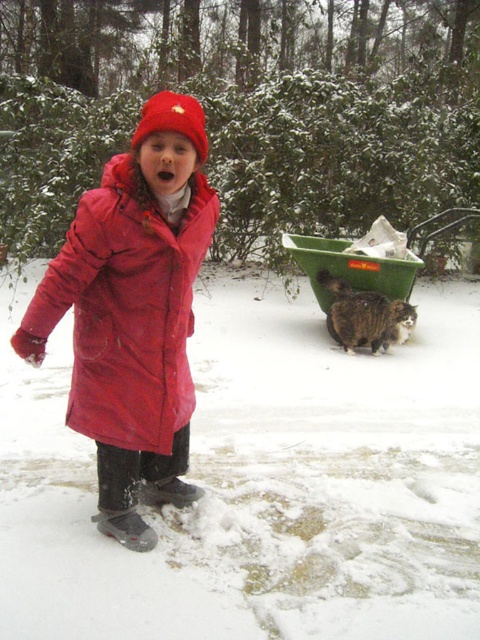
You are a photographer trying to capture the girl in the snowy scene. You notice the matte red coat at center and the red fleece hat at center. Which object is closer to your camera lens?

The matte red coat at center is closer to the camera lens because it is further to the viewer than the red fleece hat at center.

In the scene shown: You are standing at the origin point in the snowy scene. There are two points marked in the image. The first point is at coordinates point [397,284] and the second is at point [200,163]. If you want to move towards the point that is further away from you, which coordinate should you head towards?

Point [397,284] is behind point [200,163], so you should head towards point [397,284] as it is further away from the origin.